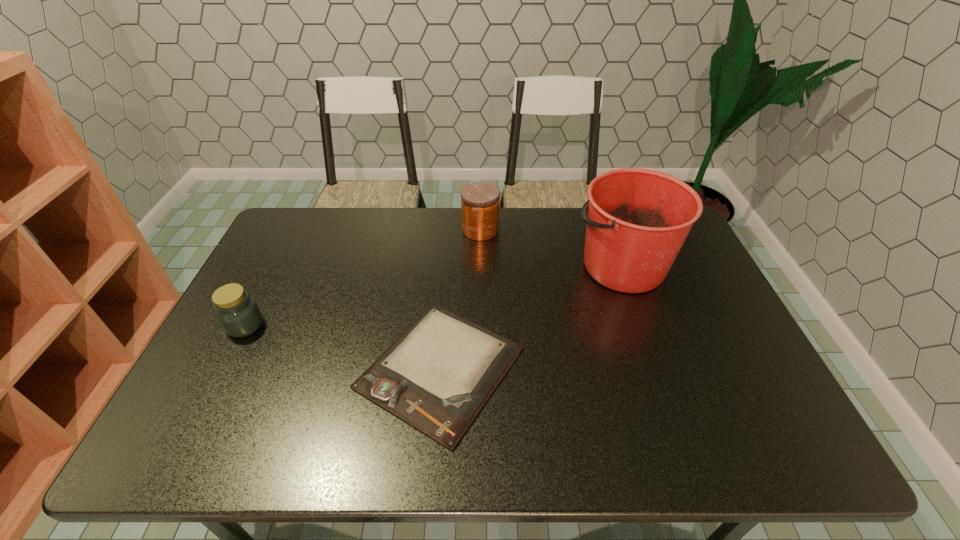
Locate an element on the screen. This screenshot has width=960, height=540. vacant space at the right edge of the desktop is located at coordinates (708, 326).

Identify the location of vacant point at the far left corner. The image size is (960, 540). (315, 219).

Identify the location of free space at the near right corner of the desktop. (756, 448).

In order to click on free spot between the taller jar and the tallest object in this screenshot , I will do `click(551, 248)`.

Locate an element on the screen. The width and height of the screenshot is (960, 540). empty space between the second shortest object and the clipboard is located at coordinates (343, 347).

At what (x,y) coordinates should I click in order to perform the action: click on vacant point located between the tallest object and the leftmost object. Please return your answer as a coordinate pair (x, y). The image size is (960, 540). Looking at the image, I should click on (434, 295).

I want to click on empty space that is in between the tallest object and the farther jar, so click(551, 248).

Where is `free space that is in between the leftmost object and the third shortest object`? Image resolution: width=960 pixels, height=540 pixels. free space that is in between the leftmost object and the third shortest object is located at coordinates (363, 278).

Identify the location of free space between the taller jar and the clipboard. The width and height of the screenshot is (960, 540). (461, 299).

The width and height of the screenshot is (960, 540). What are the coordinates of `unoccupied position between the leftmost object and the clipboard` in the screenshot? It's located at (343, 347).